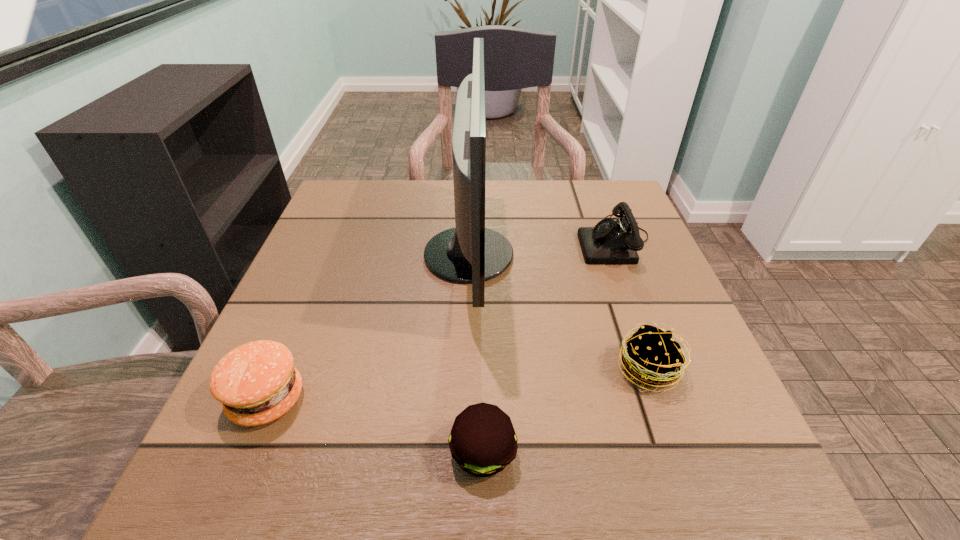
This screenshot has width=960, height=540. I want to click on free space located on the front of the rightmost patty, so click(668, 426).

Where is `free spot located on the right of the second patty from left to right`? The height and width of the screenshot is (540, 960). free spot located on the right of the second patty from left to right is located at coordinates (559, 453).

The image size is (960, 540). I want to click on monitor present at the far edge, so click(x=469, y=253).

Where is `telephone present at the far edge`? The height and width of the screenshot is (540, 960). telephone present at the far edge is located at coordinates (610, 242).

I want to click on object present at the near edge, so click(x=482, y=441).

At what (x,y) coordinates should I click in order to perform the action: click on object that is at the left edge. Please return your answer as a coordinate pair (x, y). Looking at the image, I should click on (257, 383).

Where is `telephone present at the right edge`? This screenshot has width=960, height=540. telephone present at the right edge is located at coordinates (610, 242).

Locate an element on the screen. This screenshot has height=540, width=960. patty that is at the right edge is located at coordinates (653, 357).

Find the location of `object that is at the far right corner`. object that is at the far right corner is located at coordinates (610, 242).

The height and width of the screenshot is (540, 960). Find the location of `free space at the far edge`. free space at the far edge is located at coordinates (402, 190).